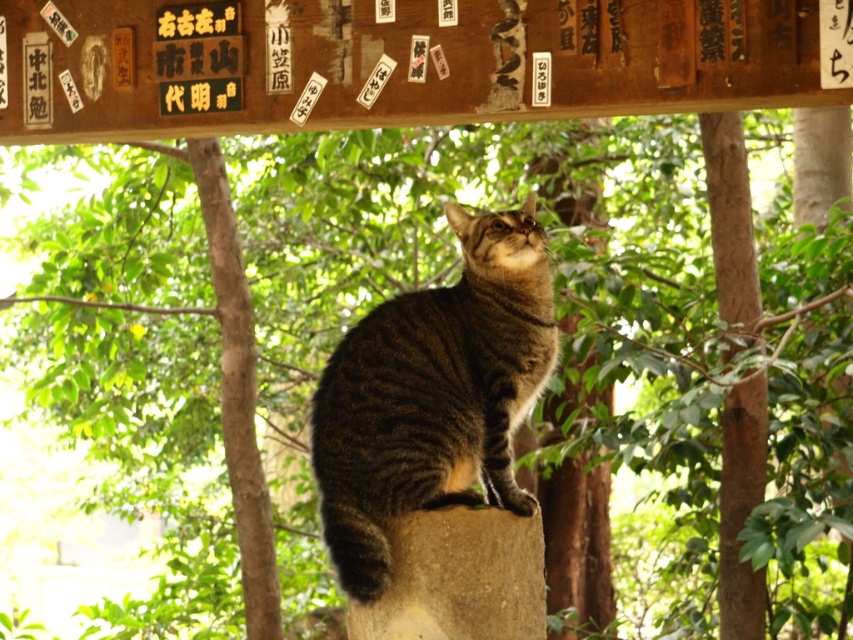
You are standing in front of the pillar where the tabby cat is sitting. You notice two points marked on the wooden beam above the cat. Which point is closer to you, point [531,240] or point [532,557]?

Point [531,240] is closer to you than point [532,557] because it is further to the viewer.

From the picture: You are a photographer standing at the base of the pillar. You want to take a closeup shot of the tabby fur cat at center and the brown rough stone at center. Can you focus on both subjects simultaneously if your camera has a depth of field that can cover 15 inches?

The tabby fur cat at center is 15.03 inches away from the brown rough stone at center. Since the depth of field can cover 15 inches, the camera might not be able to focus on both simultaneously because the distance between them is slightly over the depth of field limit.

You are a photographer trying to capture the tabby fur cat at center and the brown rough stone at center in a single shot. If you want to ensure both are fully visible in the frame, which object should you focus on first?

The tabby fur cat at center is taller than the brown rough stone at center, so you should focus on the tabby fur cat at center first to ensure its full height is captured before adjusting the frame for the shorter stone.